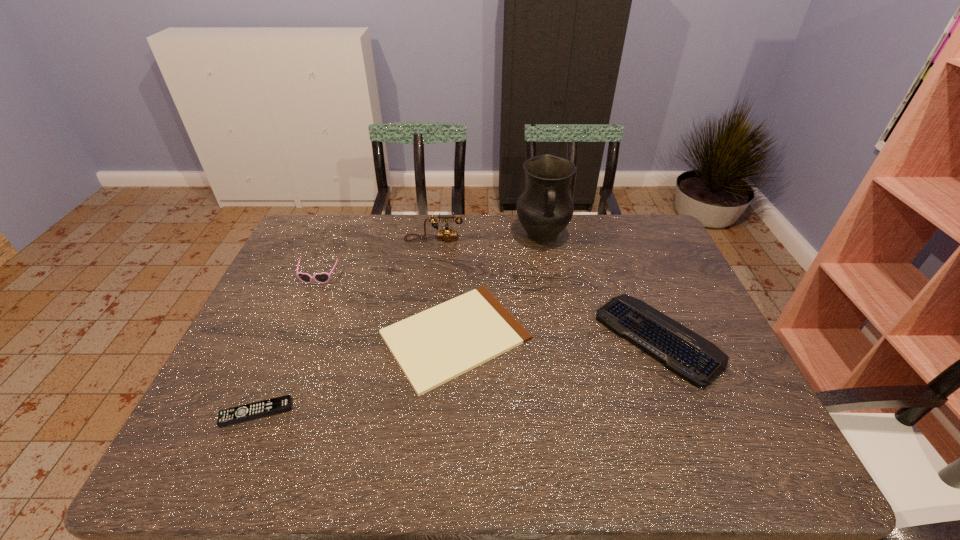
At what (x,y) coordinates should I click in order to perform the action: click on pitcher. Please return your answer as a coordinate pair (x, y). Looking at the image, I should click on (545, 208).

At what (x,y) coordinates should I click in order to perform the action: click on the second tallest object. Please return your answer as a coordinate pair (x, y). This screenshot has width=960, height=540. Looking at the image, I should click on (446, 234).

This screenshot has height=540, width=960. Find the location of `the third farthest object`. the third farthest object is located at coordinates (324, 277).

Find the location of a particular element. The width and height of the screenshot is (960, 540). the fourth shortest object is located at coordinates (324, 277).

You are a GUI agent. You are given a task and a screenshot of the screen. Output one action in this format:
    pyautogui.click(x=<x>, y=<y>)
    Task: Click on the computer keyboard
    
    Given the screenshot: What is the action you would take?
    pyautogui.click(x=685, y=353)

At what (x,y) coordinates should I click in order to perform the action: click on the fourth tallest object. Please return your answer as a coordinate pair (x, y). The image size is (960, 540). Looking at the image, I should click on (685, 353).

This screenshot has height=540, width=960. In order to click on the nearest object in this screenshot , I will do `click(255, 410)`.

Locate an element on the screen. The image size is (960, 540). remote control is located at coordinates pos(255,410).

The height and width of the screenshot is (540, 960). Identify the location of clipboard. (439, 344).

What are the coordinates of `vacant space located on the handle side of the pitcher` in the screenshot? It's located at (550, 277).